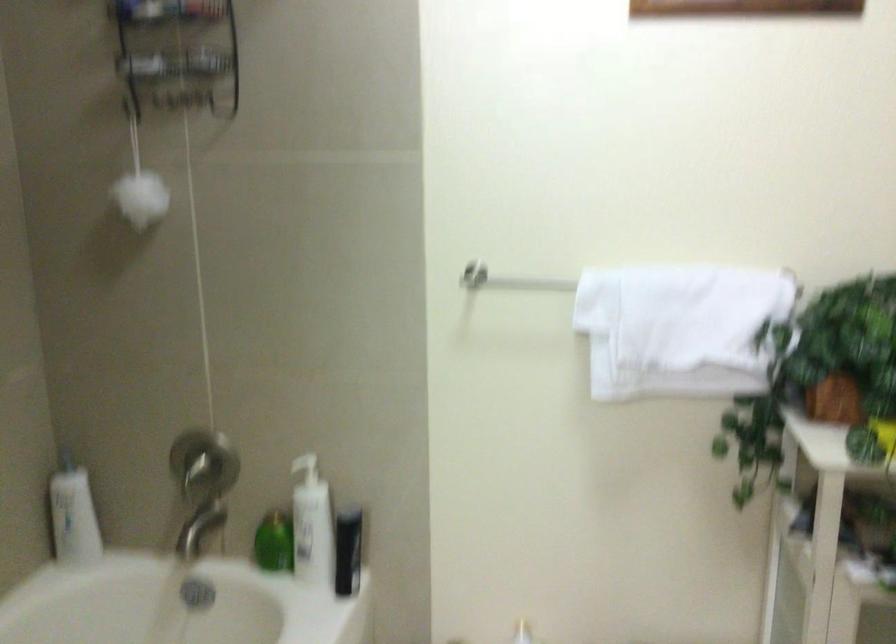
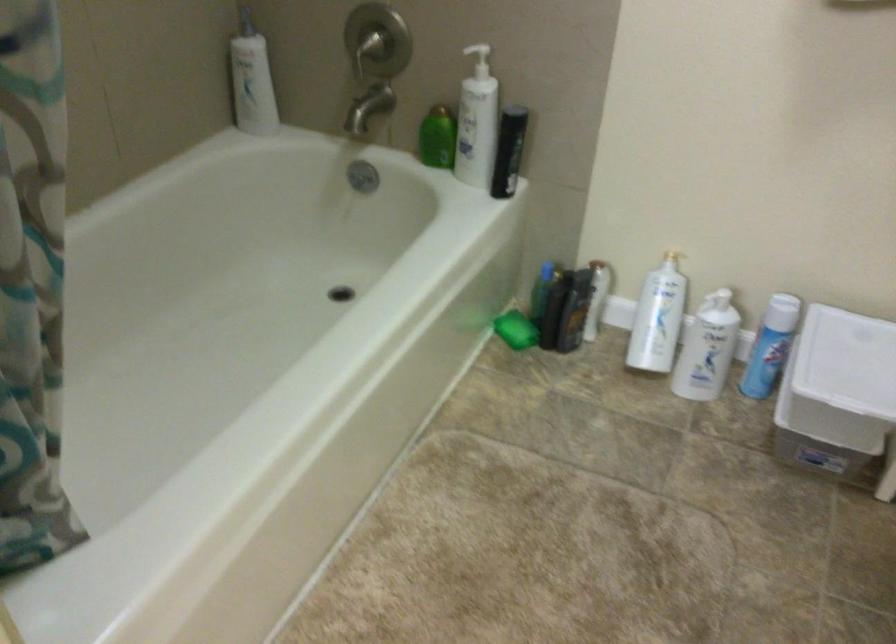
Question: The first image is from the beginning of the video and the second image is from the end. How did the camera likely rotate when shooting the video?

Choices:
 (A) Left
 (B) Right
 (C) Up
 (D) Down

Answer: (D)